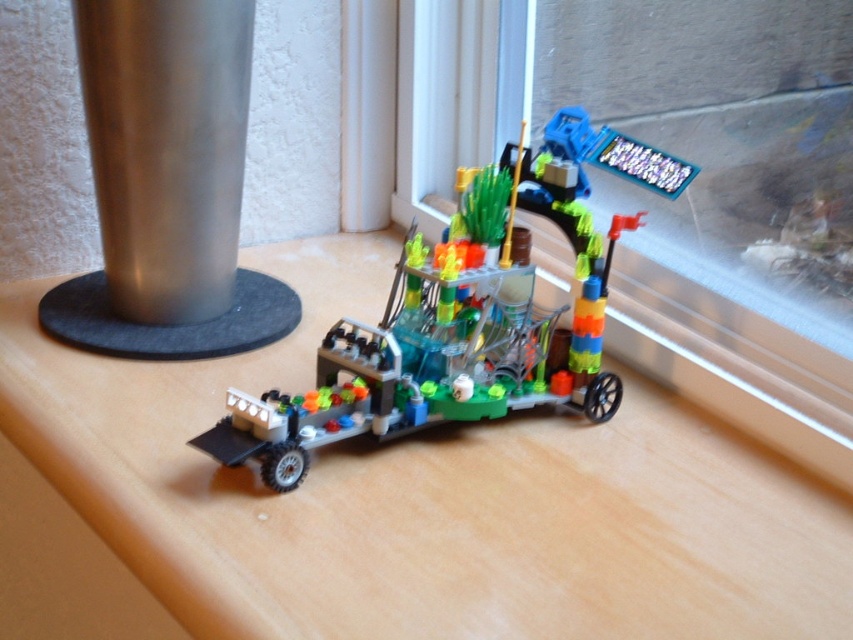
Question: Which point is closer to the camera?

Choices:
 (A) (404, 115)
 (B) (219, 458)

Answer: (B)

Question: Does transparent plastic window at upper right appear under translucent plastic vehicle at center?

Choices:
 (A) yes
 (B) no

Answer: (B)

Question: Which object is positioned closest to the transparent plastic window at upper right?

Choices:
 (A) translucent plastic vehicle at center
 (B) wooden table at center

Answer: (A)

Question: Is transparent plastic window at upper right further to the viewer compared to translucent plastic vehicle at center?

Choices:
 (A) no
 (B) yes

Answer: (B)

Question: Does wooden table at center appear on the right side of transparent plastic window at upper right?

Choices:
 (A) yes
 (B) no

Answer: (B)

Question: Which point is farther to the camera?

Choices:
 (A) wooden table at center
 (B) translucent plastic vehicle at center
 (C) transparent plastic window at upper right

Answer: (C)